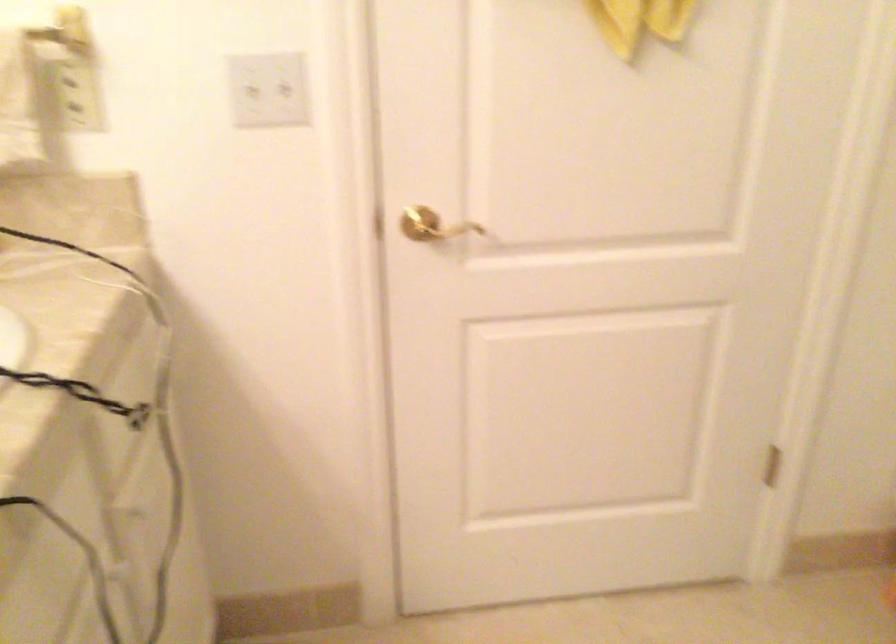
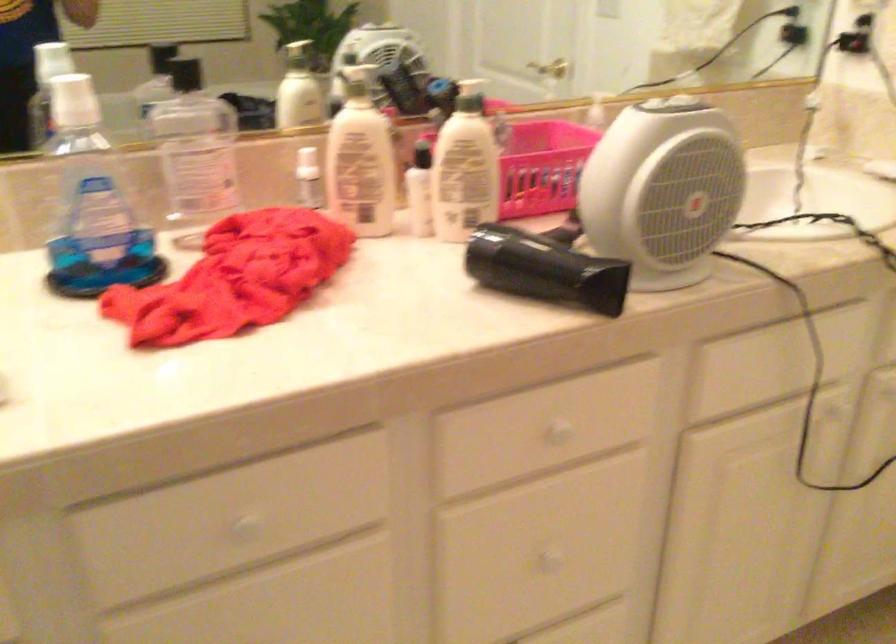
The first image is from the beginning of the video and the second image is from the end. How did the camera likely rotate when shooting the video?

The rotation direction of the camera is left-down.